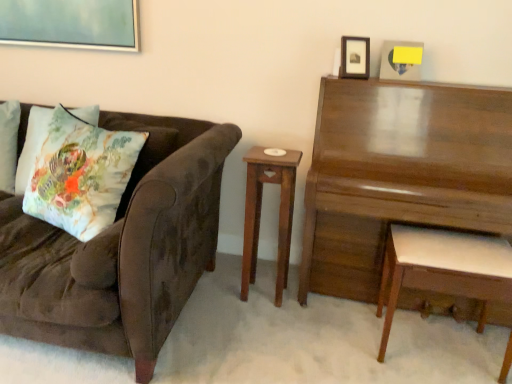
What do you see at coordinates (121, 249) in the screenshot? The width and height of the screenshot is (512, 384). I see `velvet brown couch at left` at bounding box center [121, 249].

Image resolution: width=512 pixels, height=384 pixels. What do you see at coordinates (32, 145) in the screenshot? I see `floral fabric pillow at left` at bounding box center [32, 145].

Describe the element at coordinates (399, 174) in the screenshot. I see `glossy wood piano at upper right` at that location.

In order to face glossy wood piano at upper right, should I rotate leftwards or rightwards?

To face it directly, rotate right by 21.991 degrees.

Describe the element at coordinates (401, 60) in the screenshot. I see `wooden picture frame at upper right, acting as the 1th picture frame starting from the right` at that location.

The image size is (512, 384). I want to click on floral cotton cushion at left, so click(80, 174).

Is floral cotton cushion at left closer to the viewer compared to wooden nightstand at center?

Yes, it is.

Locate an element on the screen. This screenshot has height=384, width=512. nightstand below the floral cotton cushion at left (from the image's perspective) is located at coordinates (260, 213).

Consider the image. Is floral cotton cushion at left shorter than wooden nightstand at center?

Yes.

From the image's perspective, between floral cotton cushion at left and wooden nightstand at center, which one is located above?

From the image's view, floral cotton cushion at left is above.

Can you confirm if wooden picture frame at upper right, acting as the 1th picture frame starting from the right, is taller than glossy wood piano at upper right?

Incorrect, the height of wooden picture frame at upper right, acting as the 1th picture frame starting from the right, is not larger of that of glossy wood piano at upper right.

Is glossy wood piano at upper right completely or partially inside wooden picture frame at upper right, acting as the 1th picture frame starting from the right?

No, wooden picture frame at upper right, acting as the 1th picture frame starting from the right, does not contain glossy wood piano at upper right.

Is wooden picture frame at upper right, acting as the 1th picture frame starting from the right, facing towards glossy wood piano at upper right?

No, wooden picture frame at upper right, acting as the 1th picture frame starting from the right, is not turned towards glossy wood piano at upper right.

At what (x,y) coordinates should I click in order to perform the action: click on picture frame that is the 1st one when counting backward from the glossy wood piano at upper right. Please return your answer as a coordinate pair (x, y). Looking at the image, I should click on (355, 57).

Which object is positioned more to the left, glossy wood piano at upper right or wooden picture frame at upper right, marked as the first picture frame in a left-to-right arrangement?

wooden picture frame at upper right, marked as the first picture frame in a left-to-right arrangement.

Is glossy wood piano at upper right in contact with wooden picture frame at upper right, marked as the first picture frame in a left-to-right arrangement?

No, glossy wood piano at upper right is not making contact with wooden picture frame at upper right, marked as the first picture frame in a left-to-right arrangement.

Who is shorter, glossy wood piano at upper right or wooden picture frame at upper right, marked as the first picture frame in a left-to-right arrangement?

Standing shorter between the two is wooden picture frame at upper right, marked as the first picture frame in a left-to-right arrangement.

Considering the positions of point (335, 191) and point (104, 126), is point (335, 191) closer or farther from the camera than point (104, 126)?

Point (335, 191) is positioned closer to the camera compared to point (104, 126).

Where is `table behind the velvet brown couch at left`? Image resolution: width=512 pixels, height=384 pixels. table behind the velvet brown couch at left is located at coordinates [399, 174].

Are glossy wood piano at upper right and velvet brown couch at left far apart?

That's not correct — glossy wood piano at upper right is a little close to velvet brown couch at left.

Which of these two, glossy wood piano at upper right or velvet brown couch at left, is wider?

velvet brown couch at left.

Based on the photo, between wooden picture frame at upper right, acting as the 1th picture frame starting from the right, and wooden picture frame at upper right, marked as the 2th picture frame in a right-to-left arrangement, which one is positioned behind?

wooden picture frame at upper right, acting as the 1th picture frame starting from the right, is further from the camera.

Can you confirm if wooden picture frame at upper right, the 2th picture frame from the left, is wider than wooden picture frame at upper right, marked as the first picture frame in a left-to-right arrangement?

No.

From the image's perspective, is wooden picture frame at upper right, the 2th picture frame from the left, under wooden picture frame at upper right, marked as the 2th picture frame in a right-to-left arrangement?

Indeed, from the image's perspective, wooden picture frame at upper right, the 2th picture frame from the left, is shown beneath wooden picture frame at upper right, marked as the 2th picture frame in a right-to-left arrangement.

Does velvet brown couch at left have a lesser height compared to wooden picture frame at upper right, acting as the 1th picture frame starting from the right?

No.

Would you say velvet brown couch at left is to the left or to the right of wooden picture frame at upper right, acting as the 1th picture frame starting from the right, in the picture?

In the image, velvet brown couch at left appears on the left side of wooden picture frame at upper right, acting as the 1th picture frame starting from the right.

Can you confirm if velvet brown couch at left is bigger than wooden picture frame at upper right, the 2th picture frame from the left?

Indeed, velvet brown couch at left has a larger size compared to wooden picture frame at upper right, the 2th picture frame from the left.

Which of these two, floral cotton cushion at left or white wood stool at right, is smaller?

Smaller between the two is floral cotton cushion at left.

Considering the points (56, 149) and (424, 244), which point is in front, point (56, 149) or point (424, 244)?

The point (424, 244) is closer.

Is white wood stool at right located within floral cotton cushion at left?

No, white wood stool at right is not surrounded by floral cotton cushion at left.

Does floral cotton cushion at left lie in front of white wood stool at right?

No, it is behind white wood stool at right.

Find the location of `throw pillow that is above the wooden nightstand at center (from the image's perspective)`. throw pillow that is above the wooden nightstand at center (from the image's perspective) is located at coordinates (80, 174).

This screenshot has height=384, width=512. Identify the location of table in front of the wooden picture frame at upper right, acting as the 1th picture frame starting from the right. (399, 174).

Estimate the real-world distances between objects in this image. Which object is further from wooden nightstand at center, velvet brown couch at left or wooden picture frame at upper right, marked as the 2th picture frame in a right-to-left arrangement?

Based on the image, wooden picture frame at upper right, marked as the 2th picture frame in a right-to-left arrangement, appears to be further to wooden nightstand at center.

Looking at the image, which one is located further to floral fabric pillow at left, wooden picture frame at upper right, acting as the 1th picture frame starting from the right, or wooden nightstand at center?

wooden picture frame at upper right, acting as the 1th picture frame starting from the right.

From the image, which object appears to be farther from glossy wood piano at upper right, wooden picture frame at upper right, acting as the 1th picture frame starting from the right, or wooden picture frame at upper right, marked as the first picture frame in a left-to-right arrangement?

wooden picture frame at upper right, acting as the 1th picture frame starting from the right, is further to glossy wood piano at upper right.

When comparing their distances from wooden nightstand at center, does wooden picture frame at upper right, marked as the 2th picture frame in a right-to-left arrangement, or velvet brown couch at left seem closer?

Based on the image, velvet brown couch at left appears to be nearer to wooden nightstand at center.

When comparing their distances from white wood stool at right, does floral cotton cushion at left or wooden nightstand at center seem closer?

wooden nightstand at center lies closer to white wood stool at right than the other object.

Based on their spatial positions, is velvet brown couch at left or wooden nightstand at center closer to wooden picture frame at upper right, marked as the first picture frame in a left-to-right arrangement?

The object closer to wooden picture frame at upper right, marked as the first picture frame in a left-to-right arrangement, is wooden nightstand at center.

Based on their spatial positions, is wooden picture frame at upper right, acting as the 1th picture frame starting from the right, or white wood stool at right closer to glossy wood piano at upper right?

Among the two, white wood stool at right is located nearer to glossy wood piano at upper right.

Which object lies further to the anchor point wooden picture frame at upper right, acting as the 1th picture frame starting from the right, wooden picture frame at upper right, marked as the first picture frame in a left-to-right arrangement, or glossy wood piano at upper right?

Among the two, glossy wood piano at upper right is located further to wooden picture frame at upper right, acting as the 1th picture frame starting from the right.

Locate an element on the screen. The height and width of the screenshot is (384, 512). nightstand between floral fabric pillow at left and white wood stool at right is located at coordinates (260, 213).

At what (x,y) coordinates should I click in order to perform the action: click on nightstand between wooden picture frame at upper right, marked as the first picture frame in a left-to-right arrangement, and white wood stool at right from top to bottom. Please return your answer as a coordinate pair (x, y). Image resolution: width=512 pixels, height=384 pixels. Looking at the image, I should click on (260, 213).

In order to click on nightstand between floral cotton cushion at left and wooden picture frame at upper right, acting as the 1th picture frame starting from the right, in the horizontal direction in this screenshot , I will do (260, 213).

You are a GUI agent. You are given a task and a screenshot of the screen. Output one action in this format:
    pyautogui.click(x=<x>, y=<y>)
    Task: Click on the throw pillow between velvet brown couch at left and wooden nightstand at center
    The height and width of the screenshot is (384, 512).
    Given the screenshot: What is the action you would take?
    pyautogui.click(x=80, y=174)